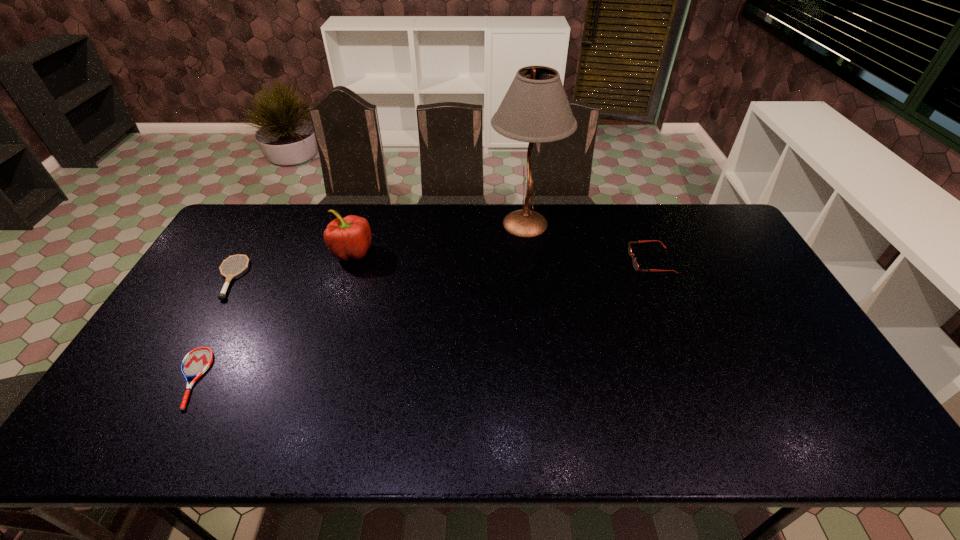
Find the location of a particular element. bell pepper situated at the far edge is located at coordinates (347, 238).

In the image, there is a desktop. Identify the location of vacant region at the far edge. (446, 217).

Find the location of a particular element. free space at the near edge of the desktop is located at coordinates (196, 416).

Where is `free space at the left edge of the desktop`? The height and width of the screenshot is (540, 960). free space at the left edge of the desktop is located at coordinates (179, 304).

I want to click on vacant space at the right edge, so click(x=841, y=402).

Locate an element on the screen. vacant space at the near left corner of the desktop is located at coordinates (146, 415).

Where is `empty space that is in between the second object from right to left and the third shortest object`? empty space that is in between the second object from right to left and the third shortest object is located at coordinates (588, 242).

Identify the location of vacant area that lies between the third tallest object and the third object from right to left. The image size is (960, 540). (501, 256).

At what (x,y) coordinates should I click in order to perform the action: click on free space between the table lamp and the rightmost object. Please return your answer as a coordinate pair (x, y). Image resolution: width=960 pixels, height=540 pixels. Looking at the image, I should click on click(x=588, y=242).

Find the location of a particular element. The width and height of the screenshot is (960, 540). free spot between the second object from right to left and the taller tennis racket is located at coordinates (377, 251).